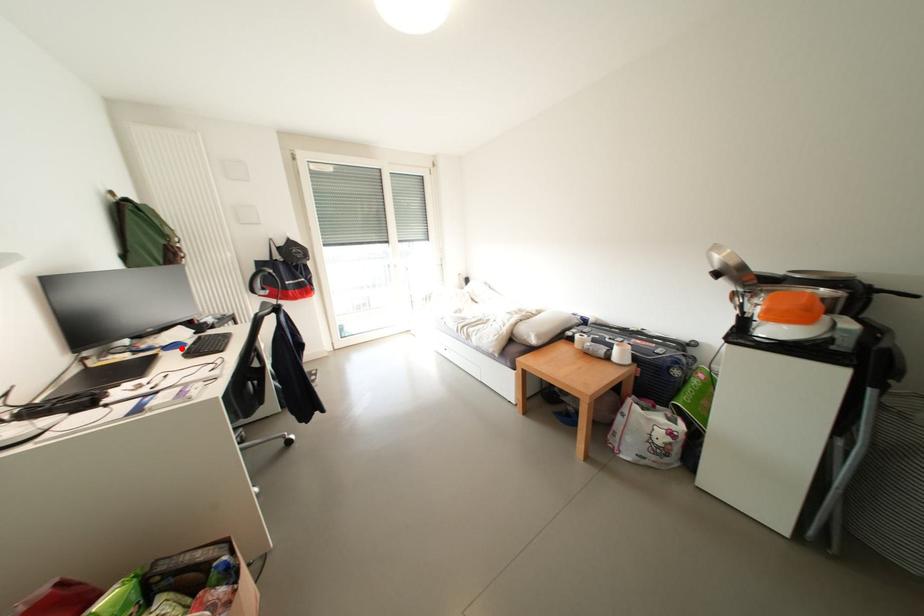
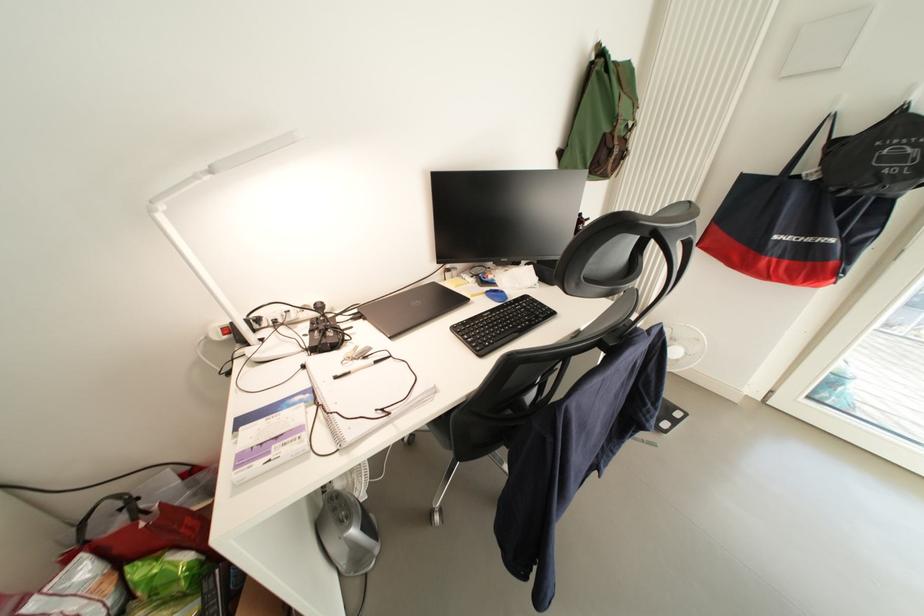
The point at the highlighted location is marked in the first image. Where is the corresponding point in the second image?

(503, 297)